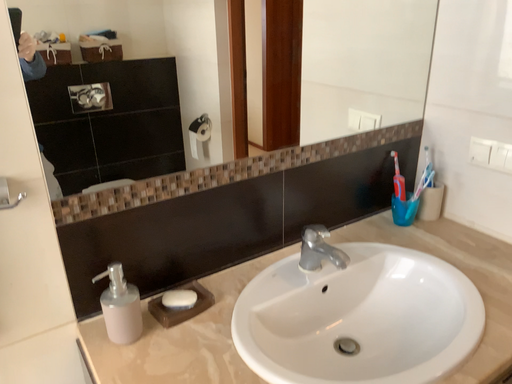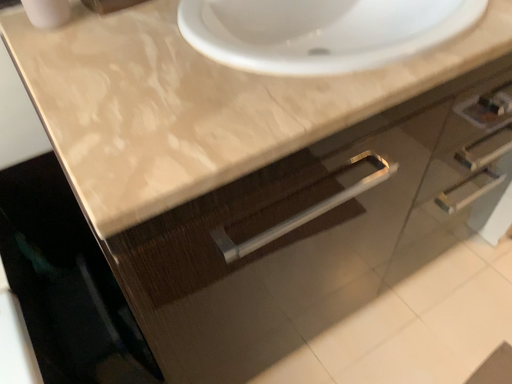
Question: Which way did the camera rotate in the video?

Choices:
 (A) rotated upward
 (B) rotated downward

Answer: (B)